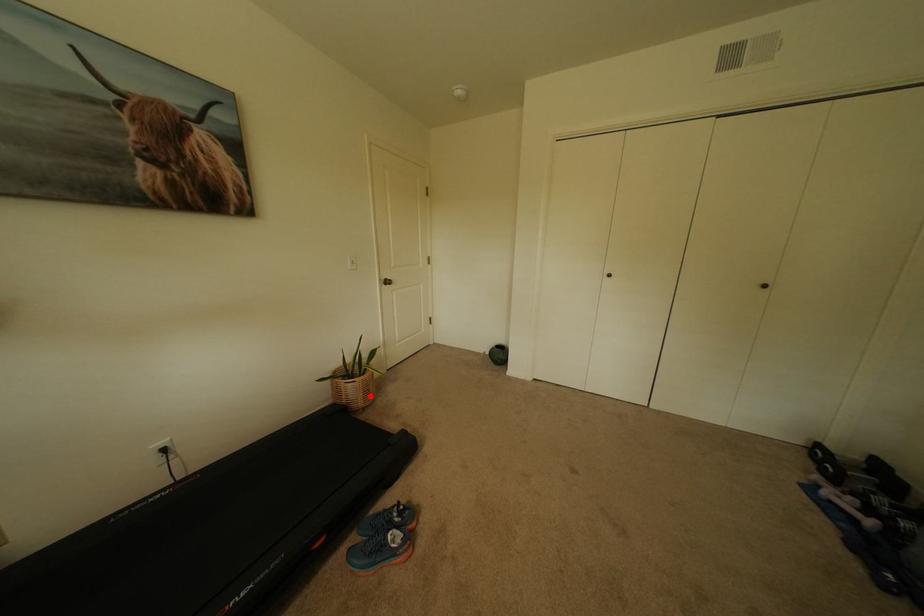
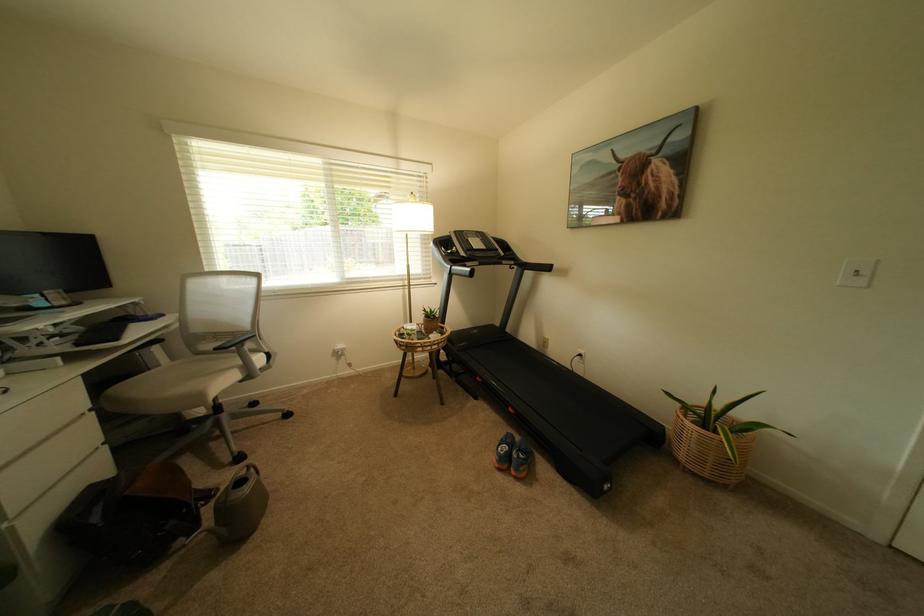
Locate, in the second image, the point that corresponds to the highlighted location in the first image.

(695, 448)